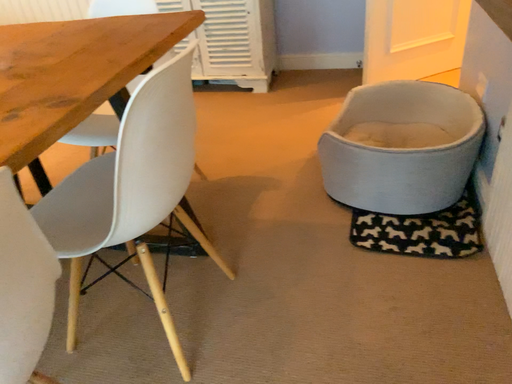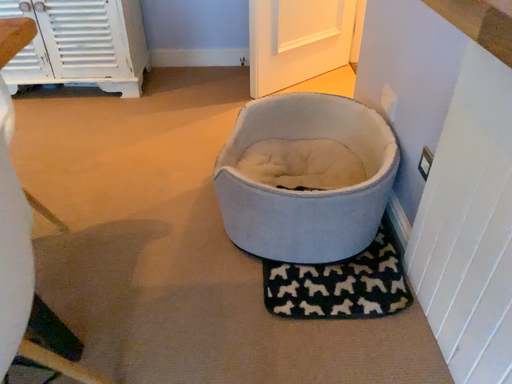
Question: How did the camera likely rotate when shooting the video?

Choices:
 (A) rotated left
 (B) rotated right

Answer: (B)